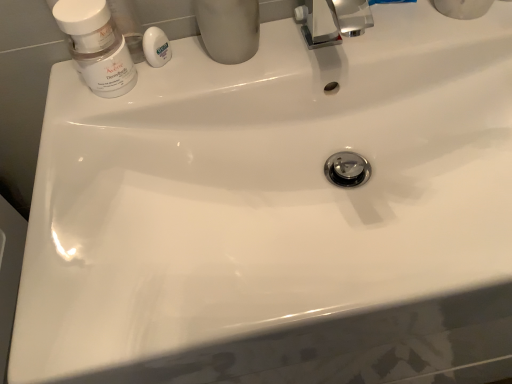
Question: Based on their positions, is white glossy soap at upper center located to the left or right of matte gray cup at upper center?

Choices:
 (A) left
 (B) right

Answer: (A)

Question: From the image's perspective, relative to matte gray cup at upper center, is white glossy soap at upper center above or below?

Choices:
 (A) below
 (B) above

Answer: (A)

Question: Based on their relative distances, which object is farther from the matte gray cup at upper center?

Choices:
 (A) white glossy soap at upper center
 (B) matte white jar at upper left

Answer: (B)

Question: Based on their relative distances, which object is farther from the matte white jar at upper left?

Choices:
 (A) white glossy soap at upper center
 (B) matte gray cup at upper center

Answer: (B)